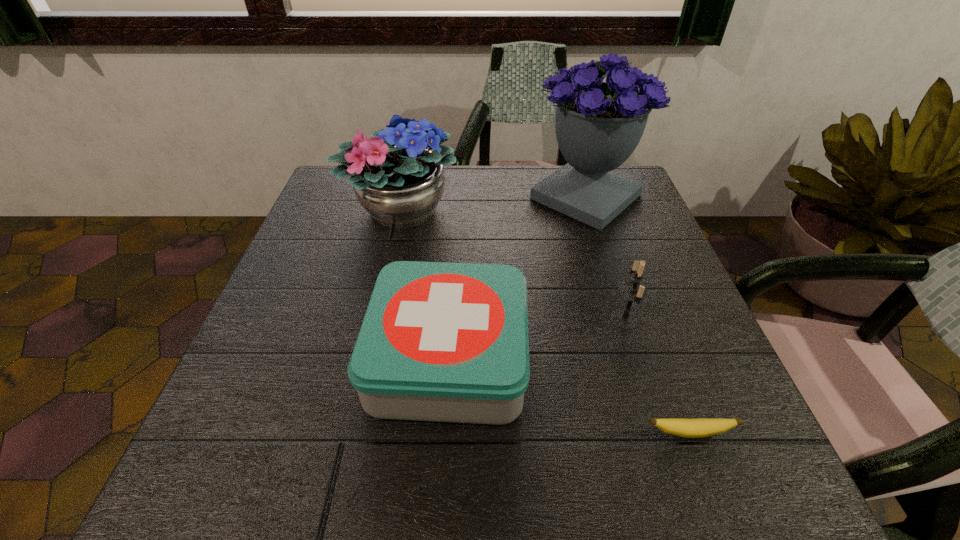
Find the location of a particular element. The height and width of the screenshot is (540, 960). vacant space at the left edge of the desktop is located at coordinates (270, 315).

Locate an element on the screen. vacant space at the right edge of the desktop is located at coordinates (666, 257).

Find the location of `free location at the near right corner`. free location at the near right corner is located at coordinates click(x=689, y=451).

Where is `empty space between the third shortest object and the second shortest object`? The height and width of the screenshot is (540, 960). empty space between the third shortest object and the second shortest object is located at coordinates (536, 339).

Locate an element on the screen. This screenshot has width=960, height=540. free space that is in between the candle holder and the taller bouquet is located at coordinates (605, 258).

Find the location of a particular element. The height and width of the screenshot is (540, 960). empty space between the shorter bouquet and the shortest object is located at coordinates (545, 322).

I want to click on free spot between the banana and the left bouquet, so click(545, 322).

You are a GUI agent. You are given a task and a screenshot of the screen. Output one action in this format:
    pyautogui.click(x=<x>, y=<y>)
    Task: Click on the free space that is in between the shortest object and the first-aid kit
    This screenshot has height=540, width=960.
    Given the screenshot: What is the action you would take?
    pyautogui.click(x=567, y=396)

You are a GUI agent. You are given a task and a screenshot of the screen. Output one action in this format:
    pyautogui.click(x=<x>, y=<y>)
    Task: Click on the free space that is in between the third tallest object and the fourth tallest object
    This screenshot has height=540, width=960.
    Given the screenshot: What is the action you would take?
    pyautogui.click(x=536, y=339)

The image size is (960, 540). Identify the location of vacant space that is in between the third tallest object and the fourth shortest object. (514, 265).